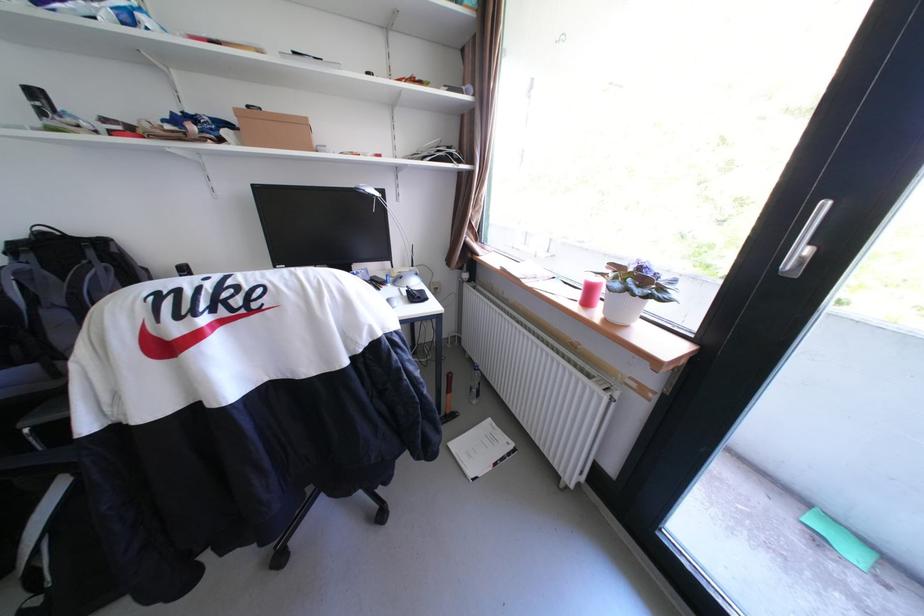
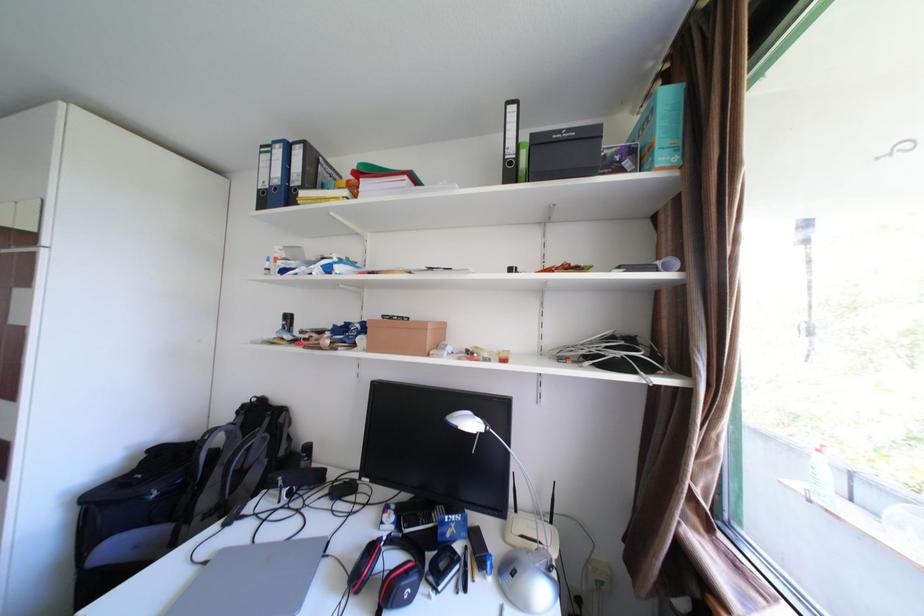
Consider the image. The first image is from the beginning of the video and the second image is from the end. How did the camera likely rotate when shooting the video?

The rotation direction of the camera is left-up.